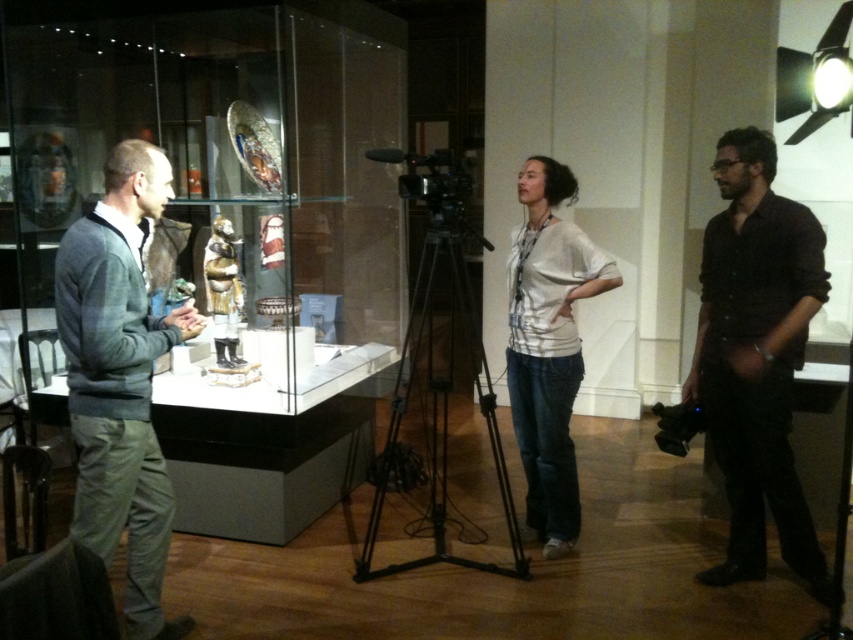
Question: Which point is farther to the camera?

Choices:
 (A) (334, 99)
 (B) (480, 236)
 (C) (73, 285)

Answer: (A)

Question: Is transparent glass box at center smaller than gray sweater at left?

Choices:
 (A) no
 (B) yes

Answer: (A)

Question: Is transparent glass box at center positioned behind white cotton shirt at center?

Choices:
 (A) yes
 (B) no

Answer: (B)

Question: Is transparent glass box at center bigger than gray sweater at left?

Choices:
 (A) no
 (B) yes

Answer: (B)

Question: Which point is closer to the camera?

Choices:
 (A) (151, 563)
 (B) (511, 502)

Answer: (A)

Question: Which object is positioned closest to the gray sweater at left?

Choices:
 (A) black matte shirt at right
 (B) white cotton shirt at center
 (C) black metal tripod at center
 (D) transparent glass box at center

Answer: (B)